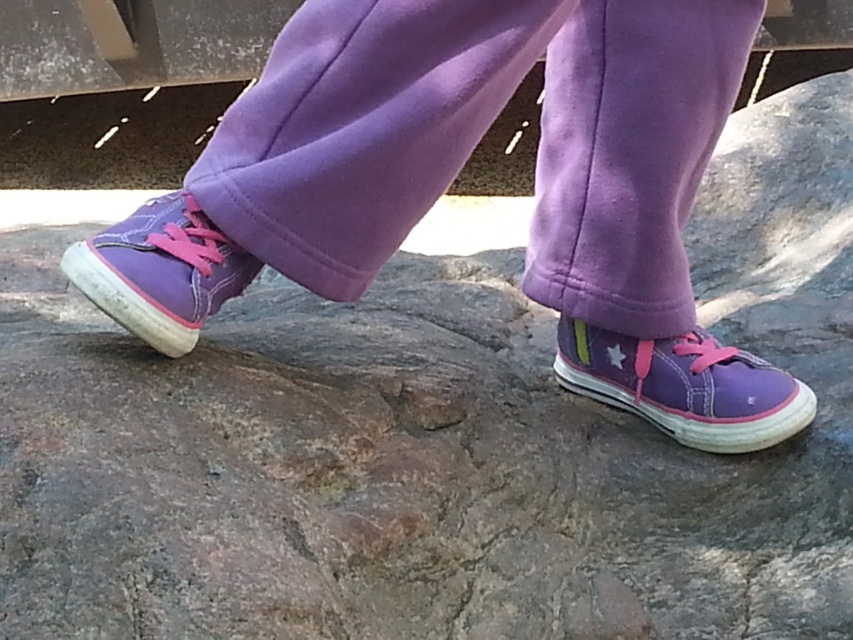
Question: Which point is closer to the camera?

Choices:
 (A) (161, 292)
 (B) (764, 422)
 (C) (724, 3)

Answer: (A)

Question: Which point appears closest to the camera in this image?

Choices:
 (A) (148, 218)
 (B) (698, 369)
 (C) (329, 93)

Answer: (C)

Question: Can you confirm if purple fleece pants at center is positioned to the right of matte purple sneaker at center?

Choices:
 (A) yes
 (B) no

Answer: (A)

Question: Which object is the farthest from the matte purple sneaker at center?

Choices:
 (A) purple fleece pants at center
 (B) purple canvas shoe at center

Answer: (B)

Question: Does purple fleece pants at center have a larger size compared to matte purple sneaker at center?

Choices:
 (A) yes
 (B) no

Answer: (A)

Question: Does purple fleece pants at center have a smaller size compared to purple canvas shoe at center?

Choices:
 (A) yes
 (B) no

Answer: (B)